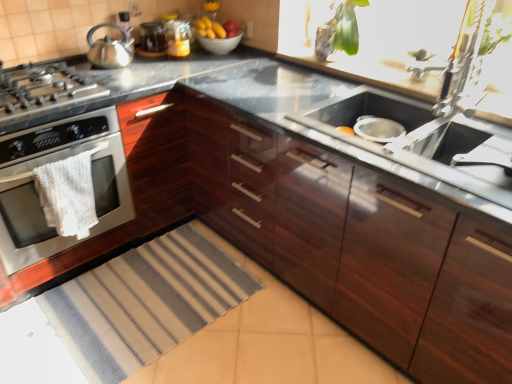
Question: Is glossy wood cabinets at center positioned with its back to metallic silver faucet at upper right?

Choices:
 (A) yes
 (B) no

Answer: (B)

Question: Considering the relative sizes of glossy wood cabinets at center and metallic silver faucet at upper right in the image provided, is glossy wood cabinets at center smaller than metallic silver faucet at upper right?

Choices:
 (A) yes
 (B) no

Answer: (B)

Question: Is metallic silver faucet at upper right completely or partially inside glossy wood cabinets at center?

Choices:
 (A) yes
 (B) no

Answer: (B)

Question: Does glossy wood cabinets at center appear on the right side of metallic silver faucet at upper right?

Choices:
 (A) no
 (B) yes

Answer: (A)

Question: Is glossy wood cabinets at center to the left of metallic silver faucet at upper right from the viewer's perspective?

Choices:
 (A) yes
 (B) no

Answer: (A)

Question: In terms of size, does glossy wood cabinets at center appear bigger or smaller than red matte apple at upper center?

Choices:
 (A) small
 (B) big

Answer: (B)

Question: From a real-world perspective, is glossy wood cabinets at center positioned above or below red matte apple at upper center?

Choices:
 (A) above
 (B) below

Answer: (B)

Question: Considering the positions of glossy wood cabinets at center and red matte apple at upper center in the image, is glossy wood cabinets at center wider or thinner than red matte apple at upper center?

Choices:
 (A) thin
 (B) wide

Answer: (B)

Question: Would you say glossy wood cabinets at center is to the left or to the right of red matte apple at upper center in the picture?

Choices:
 (A) right
 (B) left

Answer: (A)

Question: Based on their positions, is matte glass jar at upper center located to the left or right of striped fabric rug at lower left?

Choices:
 (A) left
 (B) right

Answer: (B)

Question: Is point (164, 41) closer or farther from the camera than point (197, 296)?

Choices:
 (A) closer
 (B) farther

Answer: (B)

Question: Would you say matte glass jar at upper center is inside or outside striped fabric rug at lower left?

Choices:
 (A) outside
 (B) inside

Answer: (A)

Question: Is matte glass jar at upper center wider or thinner than striped fabric rug at lower left?

Choices:
 (A) thin
 (B) wide

Answer: (A)

Question: Based on their sizes in the image, would you say yellow matte bananas at upper center is bigger or smaller than white woven towel at left?

Choices:
 (A) big
 (B) small

Answer: (B)

Question: Does point (210, 21) appear closer or farther from the camera than point (75, 228)?

Choices:
 (A) closer
 (B) farther

Answer: (B)